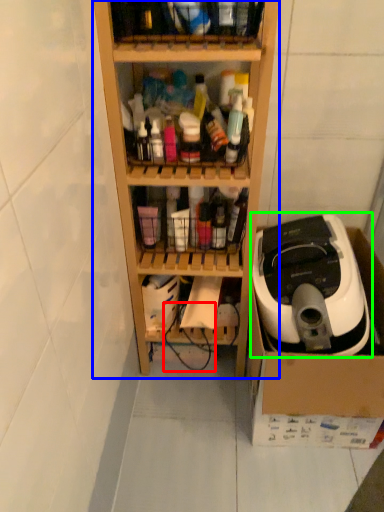
Question: Based on their relative distances, which object is farther from wire (highlighted by a red box)? Choose from shelf (highlighted by a blue box) and home appliance (highlighted by a green box).

Choices:
 (A) shelf
 (B) home appliance

Answer: (B)